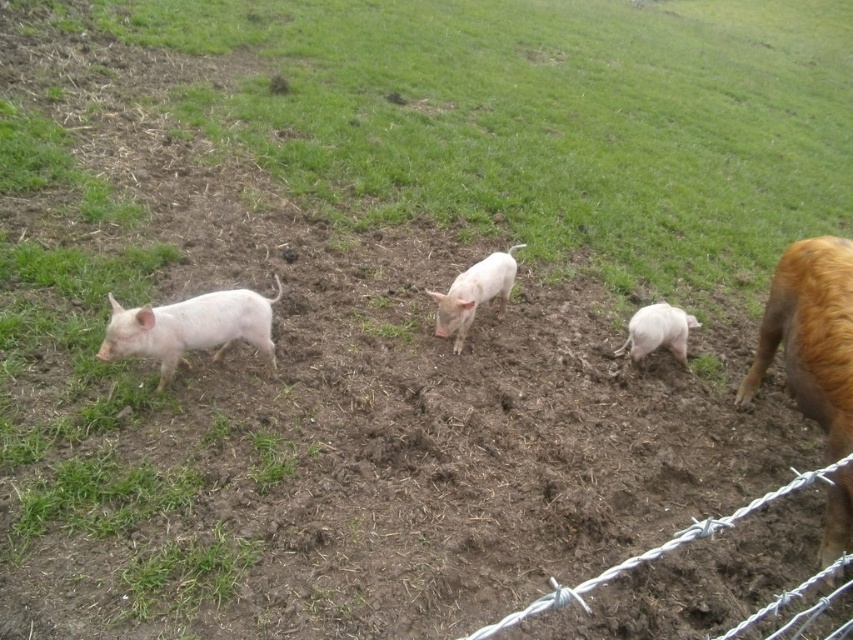
Between pink smooth piglet at left and pink smooth piglet at center, which one appears on the right side from the viewer's perspective?

pink smooth piglet at center

In the scene shown: Does pink smooth piglet at left have a greater height compared to pink smooth piglet at center?

In fact, pink smooth piglet at left may be shorter than pink smooth piglet at center.

Is point (276, 364) positioned in front of point (463, 275)?

Yes, point (276, 364) is in front of point (463, 275).

Find the location of a particular element. The width and height of the screenshot is (853, 640). pink smooth piglet at left is located at coordinates (190, 328).

Measure the distance between pink smooth piglet at left and pink smooth pig at lower right.

pink smooth piglet at left is 1.93 meters from pink smooth pig at lower right.

This screenshot has width=853, height=640. Find the location of `pink smooth piglet at left`. pink smooth piglet at left is located at coordinates (190, 328).

Who is more distant from viewer, (242, 314) or (695, 320)?

The point (695, 320) is more distant.

You are a GUI agent. You are given a task and a screenshot of the screen. Output one action in this format:
    pyautogui.click(x=<x>, y=<y>)
    Task: Click on the pink smooth piglet at left
    This screenshot has height=640, width=853.
    Given the screenshot: What is the action you would take?
    pyautogui.click(x=190, y=328)

Who is more distant from viewer, (811, 240) or (642, 346)?

Point (642, 346)

The image size is (853, 640). I want to click on brown furry pig at right, so click(x=810, y=336).